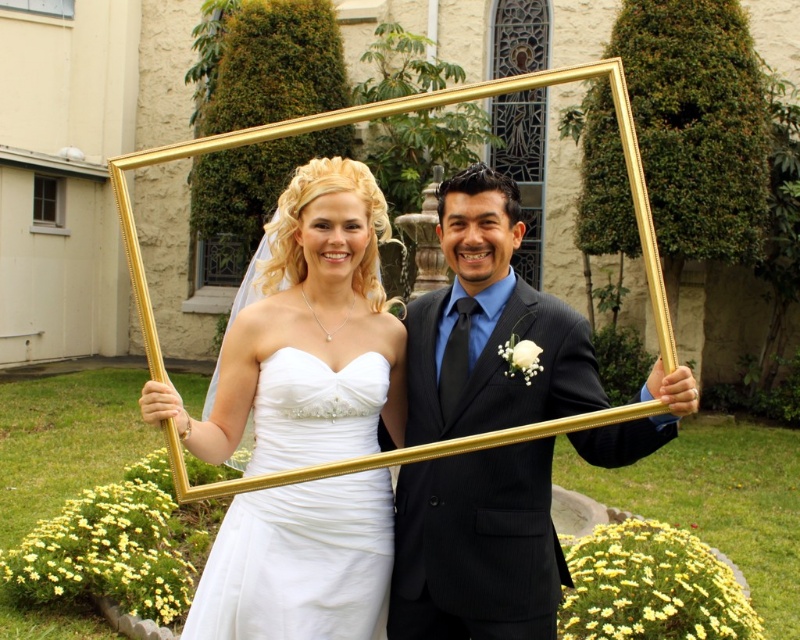
Does matte white dress at center have a greater height compared to white satin wedding dress at center?

Yes, matte white dress at center is taller than white satin wedding dress at center.

Which is behind, point (252, 534) or point (233, 502)?

The point (233, 502) is behind.

Is point (218, 417) positioned before point (289, 611)?

No.

Identify the location of matte white dress at center. (308, 336).

Can you confirm if matte white dress at center is taller than shiny black suit at center?

Correct, matte white dress at center is much taller as shiny black suit at center.

Is matte white dress at center wider than shiny black suit at center?

No.

Who is more forward, (304,369) or (426,397)?

Point (304,369)

This screenshot has height=640, width=800. Identify the location of matte white dress at center. (308, 336).

Does shiny black suit at center have a greater width compared to white satin wedding dress at center?

Correct, the width of shiny black suit at center exceeds that of white satin wedding dress at center.

Is shiny black suit at center taller than white satin wedding dress at center?

Indeed, shiny black suit at center has a greater height compared to white satin wedding dress at center.

Find the location of a particular element. shiny black suit at center is located at coordinates (490, 326).

At what (x,y) coordinates should I click in order to perform the action: click on shiny black suit at center. Please return your answer as a coordinate pair (x, y). This screenshot has width=800, height=640. Looking at the image, I should click on (490, 326).